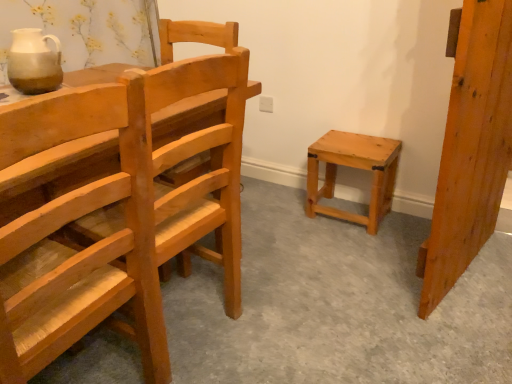
Image resolution: width=512 pixels, height=384 pixels. Find the location of `free region on the left part of natural wood door at right`. free region on the left part of natural wood door at right is located at coordinates (351, 273).